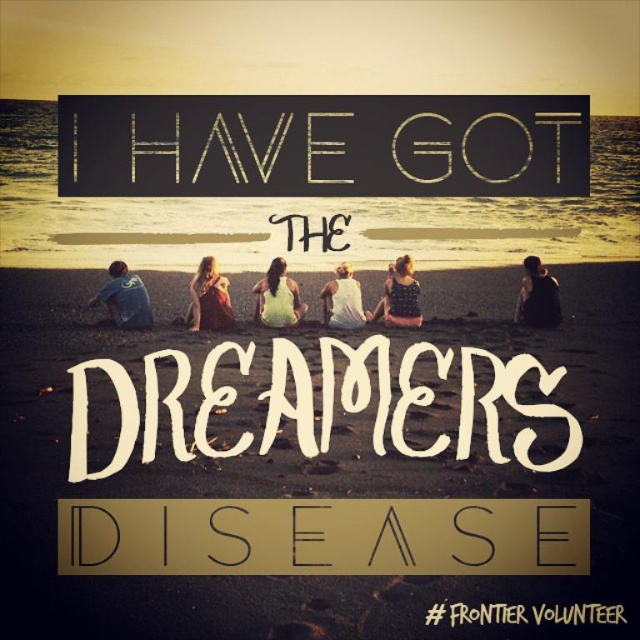
Question: Is blonde hair fabric at center further to the viewer compared to yellow fabric dress at center?

Choices:
 (A) yes
 (B) no

Answer: (A)

Question: Is blonde hair fabric at center to the right of yellow fabric dress at center from the viewer's perspective?

Choices:
 (A) no
 (B) yes

Answer: (A)

Question: Which object appears closest to the camera in this image?

Choices:
 (A) blue denim shirt at lower left
 (B) yellow fabric dress at center
 (C) blonde hair fabric at center
 (D) black matte tank top at center

Answer: (B)

Question: Which point appears closest to the camera in this image?

Choices:
 (A) (211, 256)
 (B) (118, 266)

Answer: (A)

Question: Is blue denim shirt at lower left wider than black matte tank top at center?

Choices:
 (A) yes
 (B) no

Answer: (B)

Question: Considering the real-world distances, which object is closest to the black matte tank top at center?

Choices:
 (A) white cotton shirt at center
 (B) blonde hair fabric at center
 (C) blue denim shirt at lower left
 (D) patterned fabric dress at center

Answer: (D)